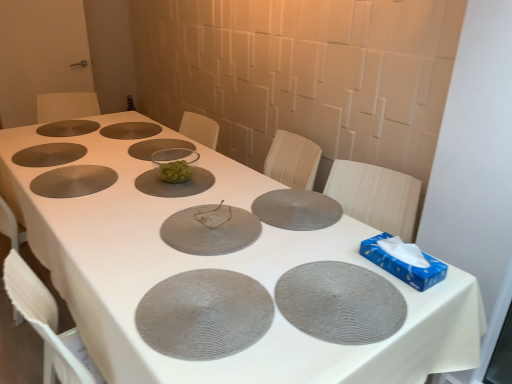
Find the location of `free spot above gray textured placemat at lower right, which ranks as the second glass plate in front-to-back order (from a real-world perspective)`. free spot above gray textured placemat at lower right, which ranks as the second glass plate in front-to-back order (from a real-world perspective) is located at coordinates (337, 291).